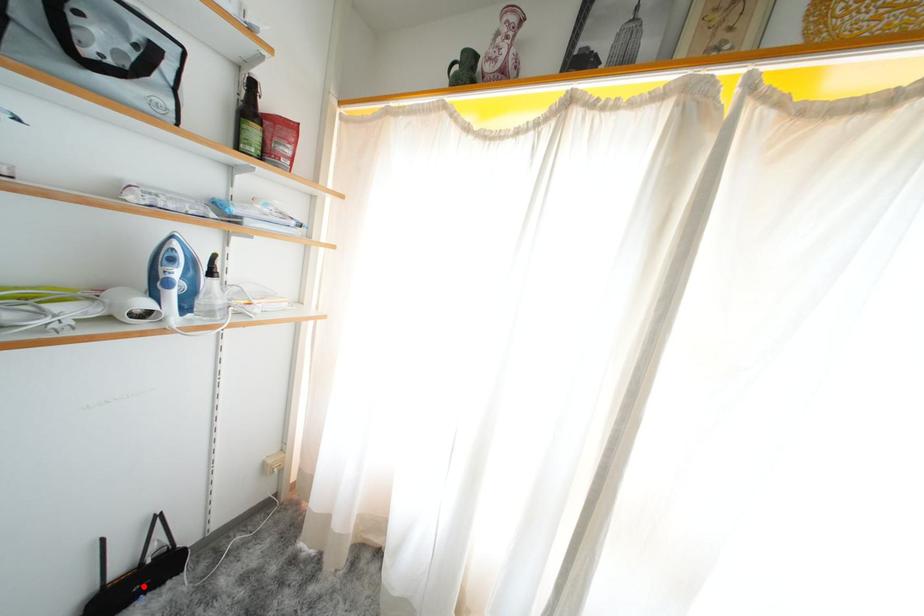
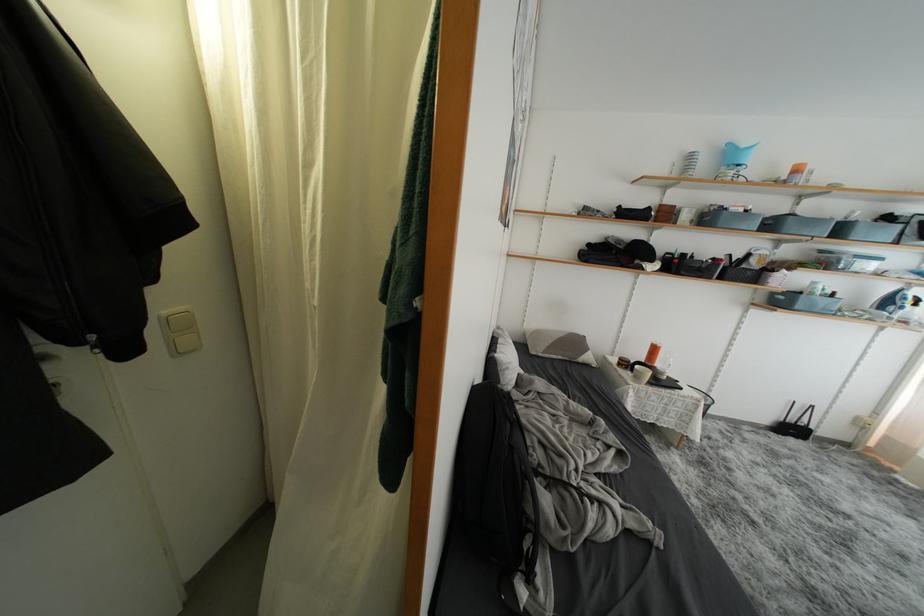
The point at the highlighted location is marked in the first image. Where is the corresponding point in the second image?

(797, 434)